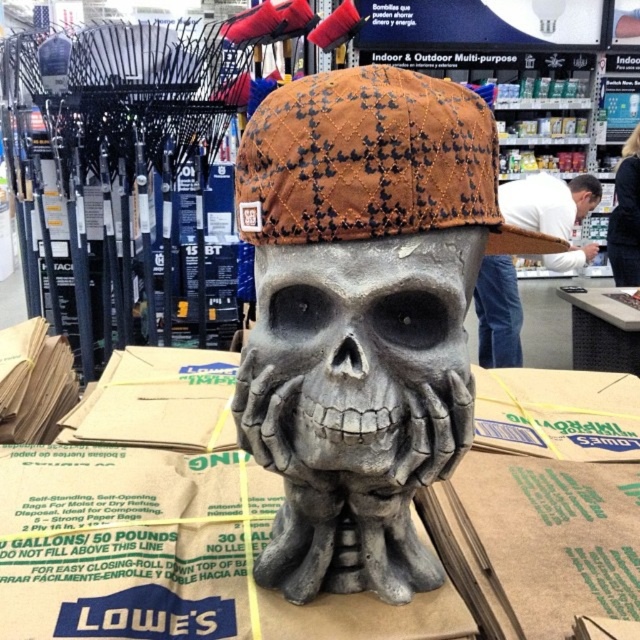
You are a customer at Lowe store and you want to buy the matte brown fabric skull at center and the black fabric hair at upper right. Which object is located to the left of the other?

The matte brown fabric skull at center is located to the left of the black fabric hair at upper right.

You are a customer at Lowe hardware store and you want to place a decorative item between the white shirt at upper center and the black fabric hair at upper right. Can you fit it if the item is 36 inches long?

The white shirt at upper center and black fabric hair at upper right are 36.34 inches apart, so yes, the 36 inch item can fit between them.

What is the position of the brown quilted fabric baseball cap at center relative to the black fabric hair at upper right?

The brown quilted fabric baseball cap at center is below the black fabric hair at upper right.